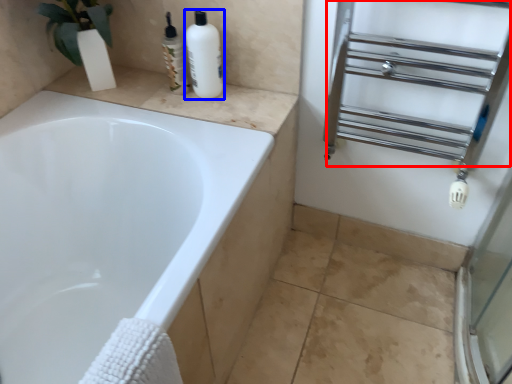
Question: Which of the following is the farthest to the observer, shelf (highlighted by a red box) or cleaning product (highlighted by a blue box)?

Choices:
 (A) shelf
 (B) cleaning product

Answer: (B)